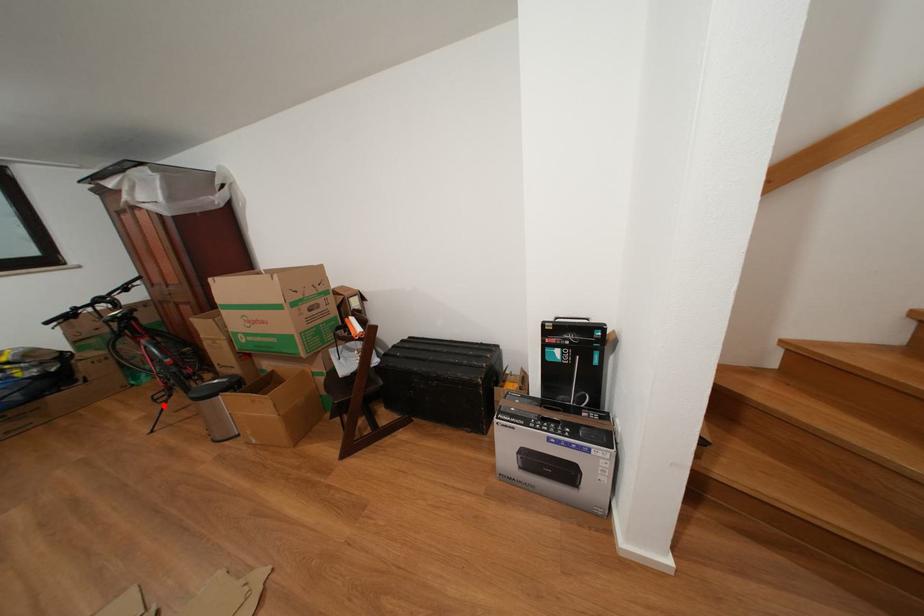
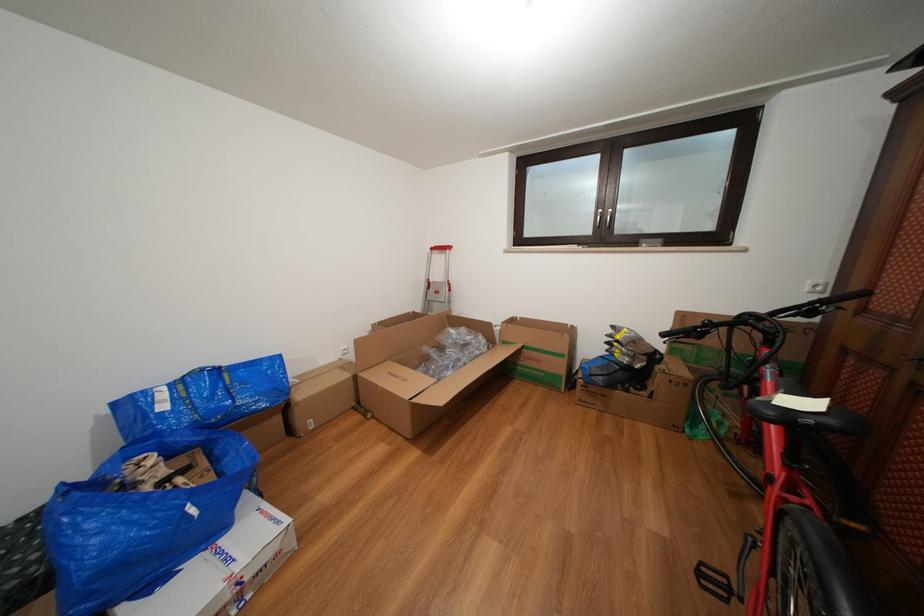
Question: A red point is marked in image1. In image2, is the corresponding 3D point closer to the camera or farther? Reply with the corresponding letter.

Choices:
 (A) The corresponding 3D point is closer.
 (B) The corresponding 3D point is farther.

Answer: (A)